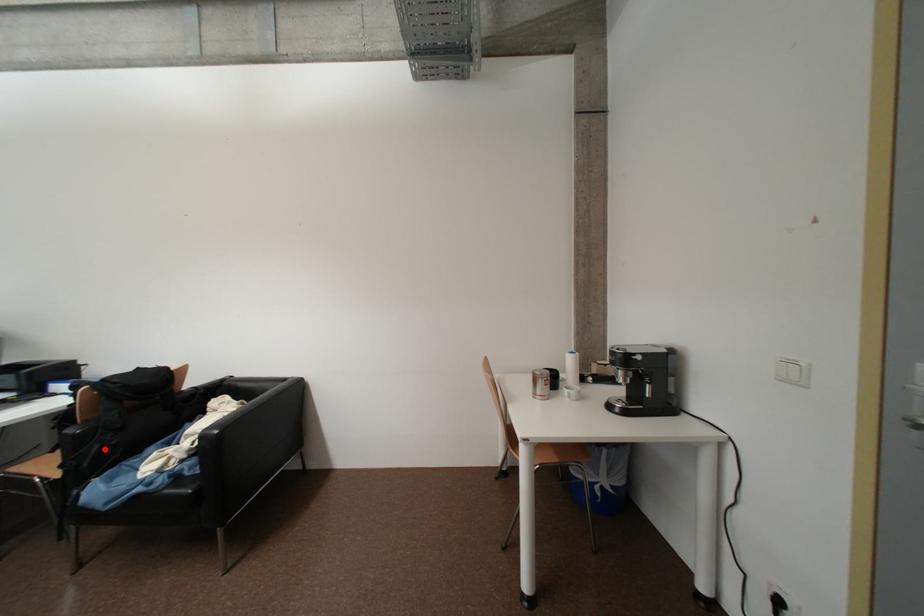
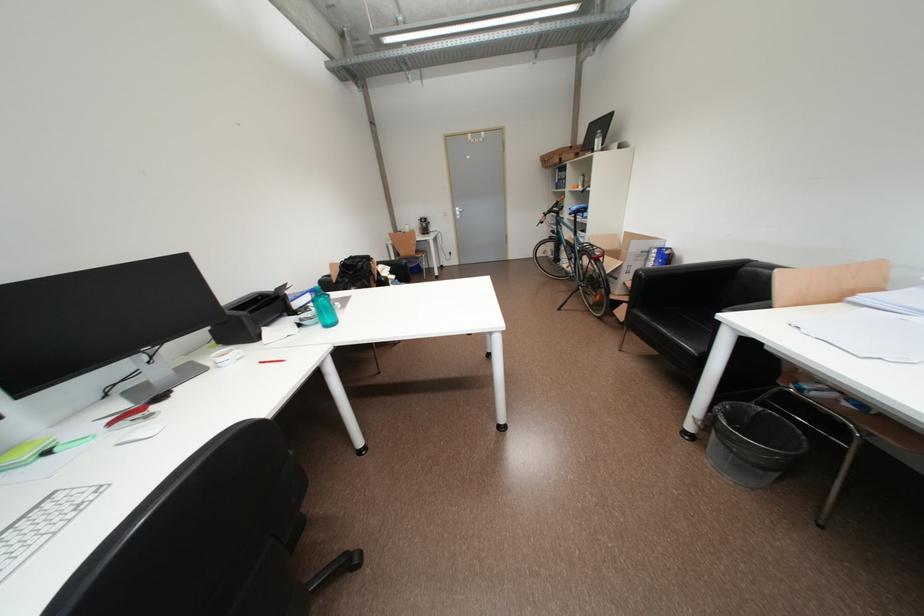
Question: I am providing you with two images of the same scene from different viewpoints. A red point is marked on the first image. At the location where the point appears in image 1, is it still visible in image 2?

Choices:
 (A) Yes
 (B) No

Answer: (B)